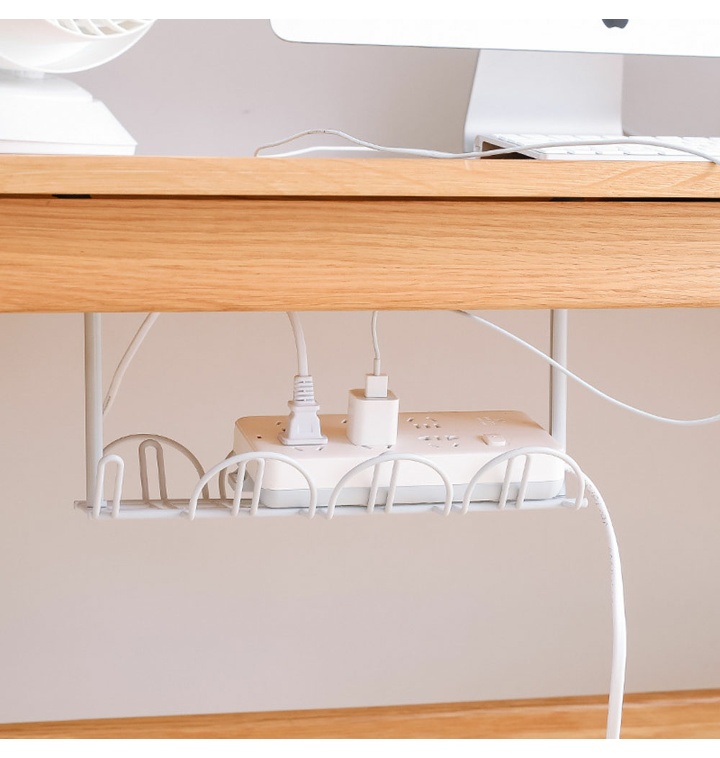
At what (x,y) coordinates should I click in order to perform the action: click on cord. Please return your answer as a coordinate pair (x, y). This screenshot has width=720, height=758. Looking at the image, I should click on (602, 509), (610, 396), (644, 148), (324, 126).